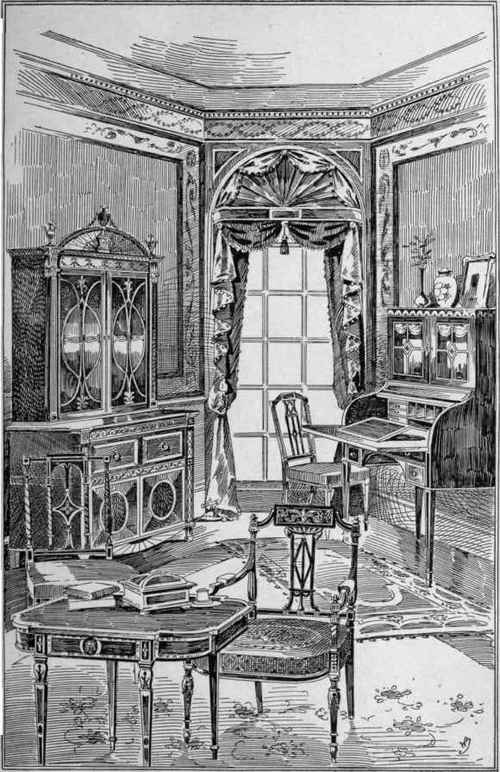
This screenshot has width=500, height=772. What are the coordinates of `chairs` in the screenshot? It's located at (324, 464), (296, 614).